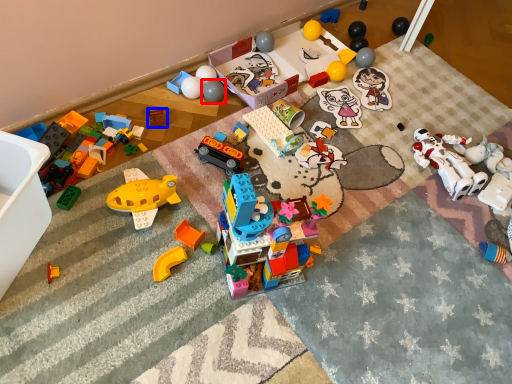
Question: Which of the following is the closest to the observer, toy (highlighted by a red box) or toy (highlighted by a blue box)?

Choices:
 (A) toy
 (B) toy

Answer: (B)